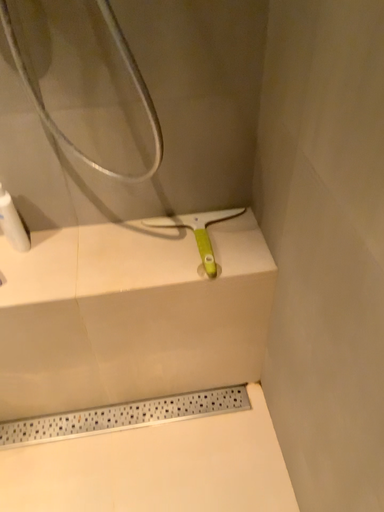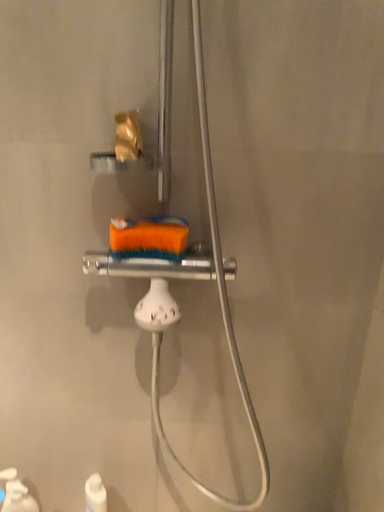
Question: Which way did the camera rotate in the video?

Choices:
 (A) rotated downward
 (B) rotated upward

Answer: (B)